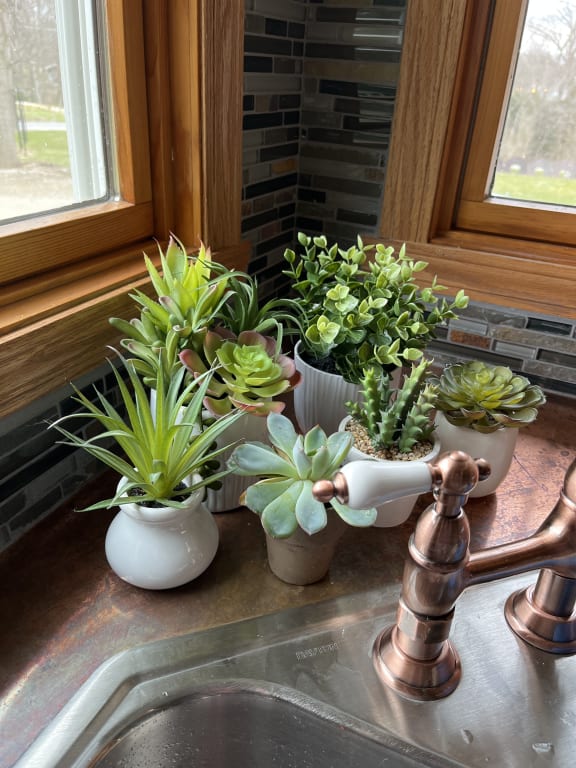
At what (x,y) coordinates should I click in order to perform the action: click on tile backsplash. Please return your answer as a coordinate pair (x, y). Looking at the image, I should click on (33, 477).